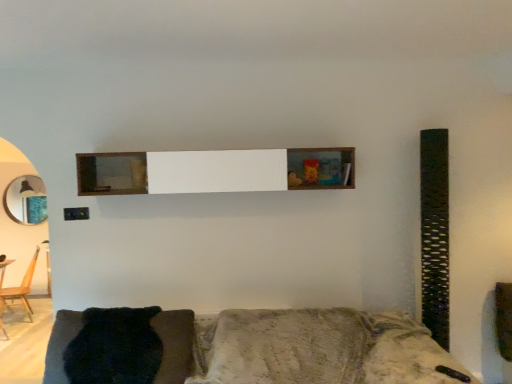
Question: Is textured gray couch at lower center oriented away from wooden table at lower left?

Choices:
 (A) no
 (B) yes

Answer: (A)

Question: Is textured gray couch at lower center taller than wooden table at lower left?

Choices:
 (A) yes
 (B) no

Answer: (B)

Question: Are textured gray couch at lower center and wooden table at lower left located far from each other?

Choices:
 (A) yes
 (B) no

Answer: (A)

Question: Could wooden table at lower left be considered to be inside textured gray couch at lower center?

Choices:
 (A) no
 (B) yes

Answer: (A)

Question: Is the position of textured gray couch at lower center more distant than that of wooden table at lower left?

Choices:
 (A) yes
 (B) no

Answer: (B)

Question: From a real-world perspective, relative to textured gray couch at lower center, is wooden chair at left vertically above or below?

Choices:
 (A) below
 (B) above

Answer: (A)

Question: Is wooden chair at left spatially inside textured gray couch at lower center, or outside of it?

Choices:
 (A) outside
 (B) inside

Answer: (A)

Question: Considering the positions of wooden chair at left and textured gray couch at lower center in the image, is wooden chair at left wider or thinner than textured gray couch at lower center?

Choices:
 (A) thin
 (B) wide

Answer: (A)

Question: Considering the positions of wooden chair at left and textured gray couch at lower center in the image, is wooden chair at left taller or shorter than textured gray couch at lower center?

Choices:
 (A) tall
 (B) short

Answer: (A)

Question: Looking at the image, does metallic circular mirror at left seem bigger or smaller compared to wooden table at lower left?

Choices:
 (A) big
 (B) small

Answer: (B)

Question: From the image's perspective, is metallic circular mirror at left positioned above or below wooden table at lower left?

Choices:
 (A) below
 (B) above

Answer: (B)

Question: Visually, is metallic circular mirror at left positioned to the left or to the right of wooden table at lower left?

Choices:
 (A) right
 (B) left

Answer: (B)

Question: Do you think metallic circular mirror at left is within wooden table at lower left, or outside of it?

Choices:
 (A) inside
 (B) outside

Answer: (B)

Question: Is textured gray couch at lower center inside the boundaries of wooden table at lower left, or outside?

Choices:
 (A) outside
 (B) inside

Answer: (A)

Question: In terms of height, does textured gray couch at lower center look taller or shorter compared to wooden table at lower left?

Choices:
 (A) tall
 (B) short

Answer: (B)